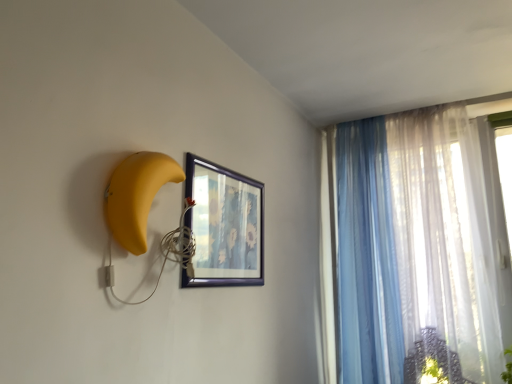
Question: From a real-world perspective, does translucent fabric curtain at right, placed as the 1th curtain when sorted from right to left, sit lower than translucent blue curtain at upper right, the 1th curtain viewed from the left?

Choices:
 (A) no
 (B) yes

Answer: (A)

Question: Is translucent fabric curtain at right, placed as the 1th curtain when sorted from right to left, next to translucent blue curtain at upper right, the 1th curtain viewed from the left?

Choices:
 (A) no
 (B) yes

Answer: (A)

Question: Does translucent fabric curtain at right, placed as the 1th curtain when sorted from right to left, have a greater width compared to translucent blue curtain at upper right, the 1th curtain viewed from the left?

Choices:
 (A) yes
 (B) no

Answer: (A)

Question: Is translucent fabric curtain at right, which ranks as the 2th curtain in left-to-right order, not near translucent blue curtain at upper right, acting as the 2th curtain starting from the right?

Choices:
 (A) yes
 (B) no

Answer: (B)

Question: Is translucent fabric curtain at right, placed as the 1th curtain when sorted from right to left, smaller than translucent blue curtain at upper right, the 1th curtain viewed from the left?

Choices:
 (A) yes
 (B) no

Answer: (B)

Question: Does translucent fabric curtain at right, which ranks as the 2th curtain in left-to-right order, appear on the right side of translucent blue curtain at upper right, acting as the 2th curtain starting from the right?

Choices:
 (A) no
 (B) yes

Answer: (B)

Question: Is wooden framed picture at center in contact with translucent fabric curtain at right, which ranks as the 2th curtain in left-to-right order?

Choices:
 (A) no
 (B) yes

Answer: (A)

Question: From a real-world perspective, is wooden framed picture at center positioned under translucent fabric curtain at right, which ranks as the 2th curtain in left-to-right order, based on gravity?

Choices:
 (A) no
 (B) yes

Answer: (B)

Question: Considering the relative sizes of wooden framed picture at center and translucent fabric curtain at right, placed as the 1th curtain when sorted from right to left, in the image provided, is wooden framed picture at center shorter than translucent fabric curtain at right, placed as the 1th curtain when sorted from right to left,?

Choices:
 (A) yes
 (B) no

Answer: (A)

Question: Is wooden framed picture at center to the right of translucent fabric curtain at right, which ranks as the 2th curtain in left-to-right order, from the viewer's perspective?

Choices:
 (A) no
 (B) yes

Answer: (A)

Question: Can you confirm if wooden framed picture at center is taller than translucent fabric curtain at right, placed as the 1th curtain when sorted from right to left?

Choices:
 (A) no
 (B) yes

Answer: (A)

Question: Can you confirm if wooden framed picture at center is smaller than translucent fabric curtain at right, which ranks as the 2th curtain in left-to-right order?

Choices:
 (A) no
 (B) yes

Answer: (B)

Question: From the image's perspective, is translucent fabric curtain at right, placed as the 1th curtain when sorted from right to left, beneath wooden framed picture at center?

Choices:
 (A) yes
 (B) no

Answer: (A)